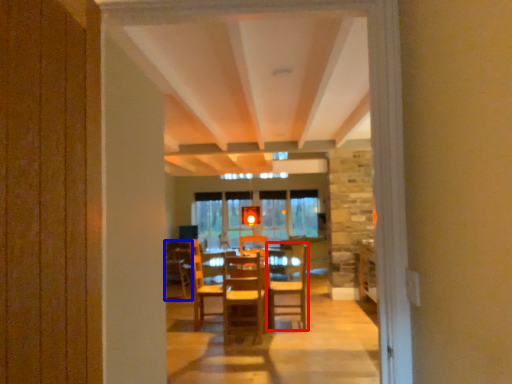
Question: Among these objects, which one is farthest to the camera, chair (highlighted by a red box) or armchair (highlighted by a blue box)?

Choices:
 (A) chair
 (B) armchair

Answer: (B)